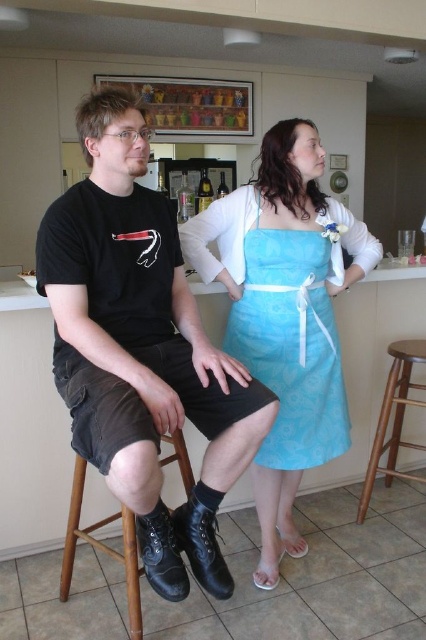
Question: Which object is the closest to the black leather boots at center?

Choices:
 (A) blue fabric dress at center
 (B) brown wooden bar stool at lower right
 (C) black leather stool at lower left

Answer: (C)

Question: In this image, where is blue fabric dress at center located relative to brown wooden bar stool at lower right?

Choices:
 (A) left
 (B) right

Answer: (A)

Question: Can you confirm if black leather boots at center is wider than blue fabric dress at center?

Choices:
 (A) yes
 (B) no

Answer: (B)

Question: Is black leather boots at center positioned in front of blue fabric dress at center?

Choices:
 (A) no
 (B) yes

Answer: (B)

Question: Which of the following is the farthest from the observer?

Choices:
 (A) (126, 528)
 (B) (206, 212)
 (C) (158, 230)
 (D) (313, 269)

Answer: (B)

Question: Considering the real-world distances, which object is farthest from the brown wooden bar stool at lower right?

Choices:
 (A) black leather stool at lower left
 (B) black leather boots at center
 (C) matte blue fabric dress at center

Answer: (A)